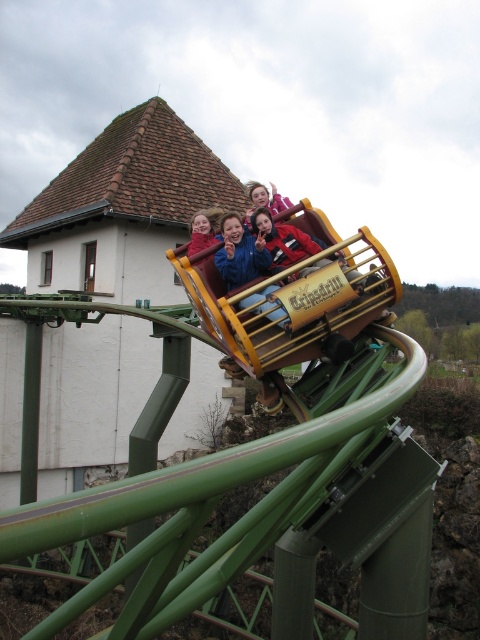
You are a photographer standing at the entrance of the amusement park. You want to take a photo of the wooden roller coaster at center and the matte blue jacket at center so that the roller coaster appears to the right of the jacket in the photo. Is this possible given their current positions?

Yes, because the wooden roller coaster at center is already positioned to the right of the matte blue jacket at center, so capturing them in that arrangement is feasible.

Based on the scene, can you determine which object is wider between the wooden roller coaster at center and the blue denim jacket at upper center?

The wooden roller coaster at center is wider than the blue denim jacket at upper center.